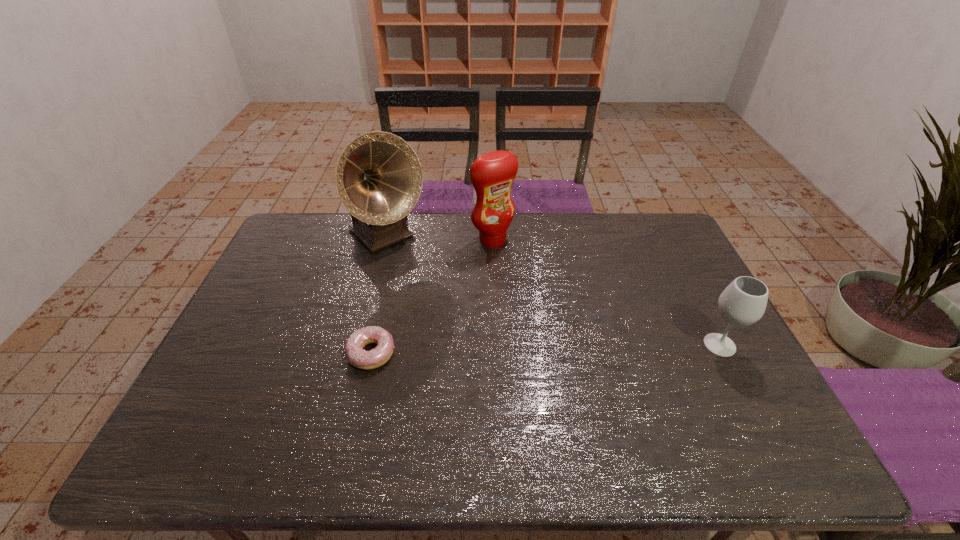
Identify the location of free space at the right edge of the desktop. This screenshot has height=540, width=960. (679, 347).

Image resolution: width=960 pixels, height=540 pixels. What are the coordinates of `free location at the near left corner of the desktop` in the screenshot? It's located at (227, 406).

This screenshot has height=540, width=960. I want to click on blank space at the far right corner, so click(669, 222).

At what (x,y) coordinates should I click in order to perform the action: click on vacant region between the tallest object and the doughnut. Please return your answer as a coordinate pair (x, y). The width and height of the screenshot is (960, 540). Looking at the image, I should click on (379, 294).

The height and width of the screenshot is (540, 960). Identify the location of vacant area that lies between the second shortest object and the shortest object. (545, 349).

Find the location of a particular element. The image size is (960, 540). free space that is in between the phonograph record and the doughnut is located at coordinates (379, 294).

Where is `free space between the second shortest object and the phonograph record`? The image size is (960, 540). free space between the second shortest object and the phonograph record is located at coordinates (553, 291).

What are the coordinates of `empty space that is in between the phonograph record and the doughnut` in the screenshot? It's located at (379, 294).

Locate an element on the screen. unoccupied position between the wineglass and the shortest object is located at coordinates (545, 349).

The height and width of the screenshot is (540, 960). In order to click on free space between the third tallest object and the shortest object in this screenshot , I will do `click(545, 349)`.